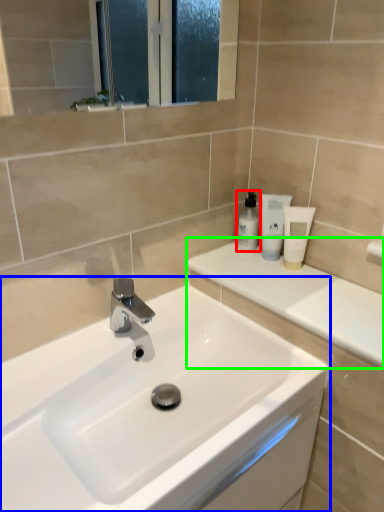
Question: Considering the real-world distances, which object is farthest from toiletry (highlighted by a red box)? sink (highlighted by a blue box) or counter top (highlighted by a green box)?

Choices:
 (A) sink
 (B) counter top

Answer: (A)